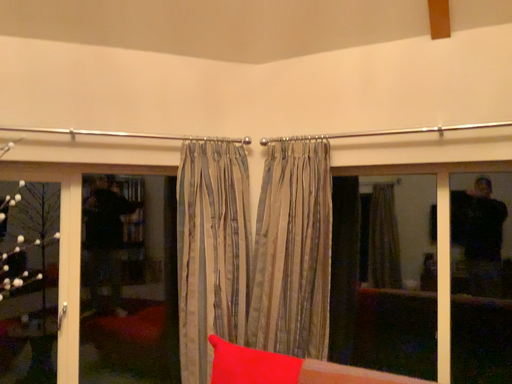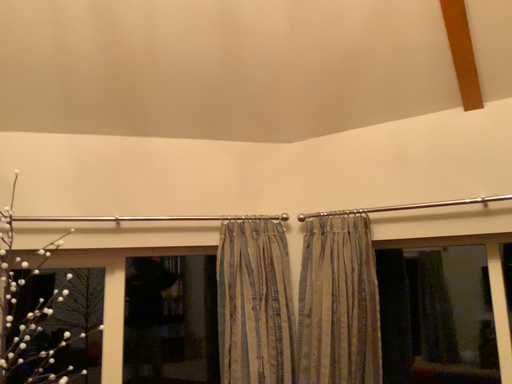
Question: Which way did the camera rotate in the video?

Choices:
 (A) rotated upward
 (B) rotated downward

Answer: (A)